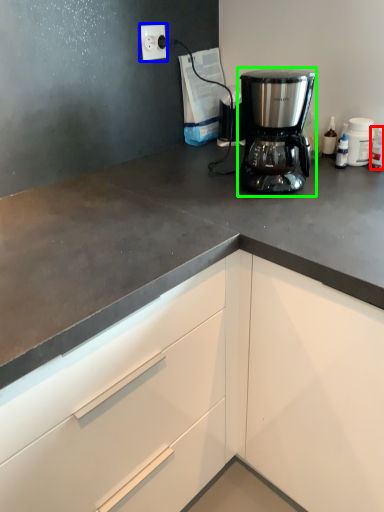
Question: Considering the real-world distances, which object is farthest from bottle (highlighted by a red box)? electric outlet (highlighted by a blue box) or coffee maker (highlighted by a green box)?

Choices:
 (A) electric outlet
 (B) coffee maker

Answer: (A)